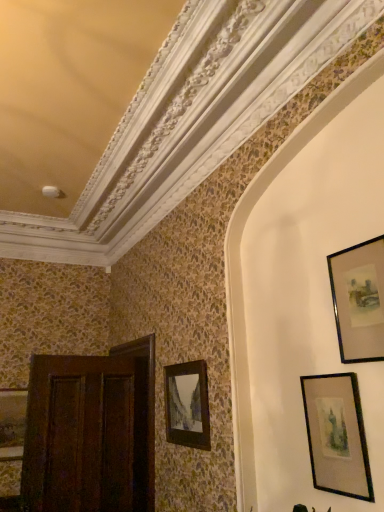
Question: Is wooden picture frame at center, the 2th picture frame from the bottom, taller than black glossy picture frame at upper right, the first picture frame in the front-to-back sequence?

Choices:
 (A) yes
 (B) no

Answer: (A)

Question: Would you say wooden picture frame at center, the 2th picture frame from the bottom, is outside black glossy picture frame at upper right, the first picture frame in the front-to-back sequence?

Choices:
 (A) yes
 (B) no

Answer: (A)

Question: Is the position of wooden picture frame at center, placed as the 2th picture frame when sorted from back to front, less distant than that of black glossy picture frame at upper right, arranged as the 4th picture frame when viewed from the left?

Choices:
 (A) no
 (B) yes

Answer: (A)

Question: Is wooden picture frame at center, which is counted as the 3th picture frame, starting from the right, to the left of black glossy picture frame at upper right, the first picture frame in the front-to-back sequence, from the viewer's perspective?

Choices:
 (A) no
 (B) yes

Answer: (B)

Question: From the image's perspective, is wooden picture frame at center, which is counted as the 3th picture frame, starting from the right, beneath black glossy picture frame at upper right, the 4th picture frame viewed from the back?

Choices:
 (A) yes
 (B) no

Answer: (A)

Question: Considering the positions of black glossy picture frame at upper right, arranged as the 4th picture frame when viewed from the left, and wooden picture frame at center, placed as the 2th picture frame when sorted from back to front, in the image, is black glossy picture frame at upper right, arranged as the 4th picture frame when viewed from the left, bigger or smaller than wooden picture frame at center, placed as the 2th picture frame when sorted from back to front,?

Choices:
 (A) big
 (B) small

Answer: (B)

Question: From a real-world perspective, is black glossy picture frame at upper right, the 1th picture frame positioned from the right, physically located above or below wooden picture frame at center, which is counted as the 3th picture frame, starting from the front?

Choices:
 (A) below
 (B) above

Answer: (B)

Question: From the image's perspective, relative to wooden picture frame at center, placed as the 2th picture frame when sorted from back to front, is black glossy picture frame at upper right, the 4th picture frame viewed from the back, above or below?

Choices:
 (A) below
 (B) above

Answer: (B)

Question: Relative to wooden picture frame at center, which is counted as the 3th picture frame, starting from the front, is black glossy picture frame at upper right, the 1th picture frame positioned from the right, in front or behind?

Choices:
 (A) front
 (B) behind

Answer: (A)

Question: Would you say black matte picture frame at lower right, placed as the third picture frame when sorted from left to right, is inside or outside black glossy picture frame at upper right, the 4th picture frame viewed from the back?

Choices:
 (A) inside
 (B) outside

Answer: (B)

Question: From the image's perspective, is black matte picture frame at lower right, the second picture frame from the front, above or below black glossy picture frame at upper right, the 4th picture frame viewed from the back?

Choices:
 (A) above
 (B) below

Answer: (B)

Question: From a real-world perspective, relative to black glossy picture frame at upper right, the 1th picture frame when ordered from top to bottom, is black matte picture frame at lower right, placed as the third picture frame when sorted from left to right, vertically above or below?

Choices:
 (A) above
 (B) below

Answer: (B)

Question: Considering the positions of point (322, 458) and point (337, 318), is point (322, 458) closer or farther from the camera than point (337, 318)?

Choices:
 (A) farther
 (B) closer

Answer: (B)

Question: Is dark wood door at left bigger or smaller than wooden picture frame at center, which is counted as the 3th picture frame, starting from the front?

Choices:
 (A) big
 (B) small

Answer: (A)

Question: Is dark wood door at left in front of or behind wooden picture frame at center, placed as the 2th picture frame when sorted from back to front, in the image?

Choices:
 (A) front
 (B) behind

Answer: (B)